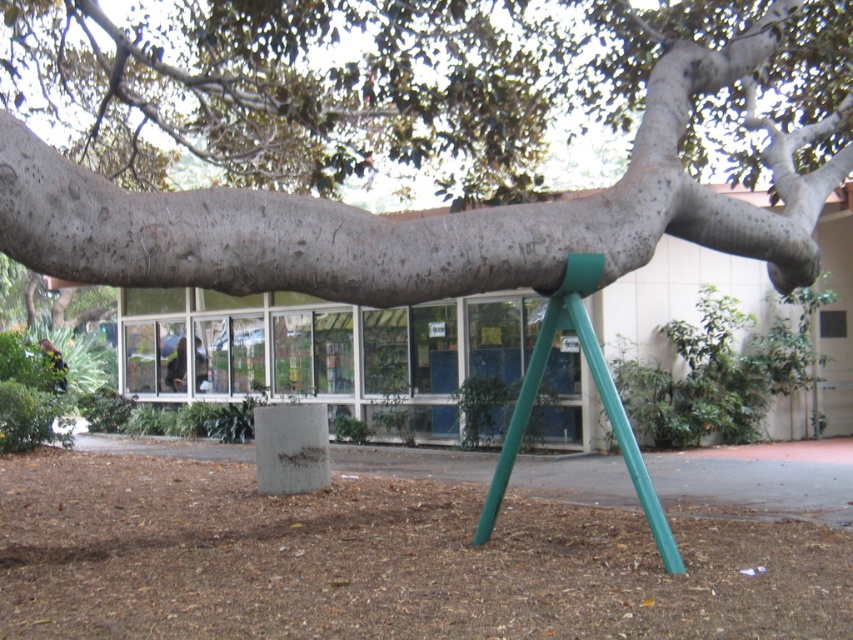
Question: Does smooth gray bark at center lie behind green matte tripod at center?

Choices:
 (A) yes
 (B) no

Answer: (B)

Question: Is smooth gray bark at center wider than green matte tripod at center?

Choices:
 (A) no
 (B) yes

Answer: (B)

Question: Which point is farther from the camera taking this photo?

Choices:
 (A) (616, 416)
 (B) (155, 58)

Answer: (B)

Question: Does smooth gray bark at center lie behind green matte tripod at center?

Choices:
 (A) yes
 (B) no

Answer: (B)

Question: Which point is farther from the camera taking this photo?

Choices:
 (A) (608, 420)
 (B) (709, 140)

Answer: (B)